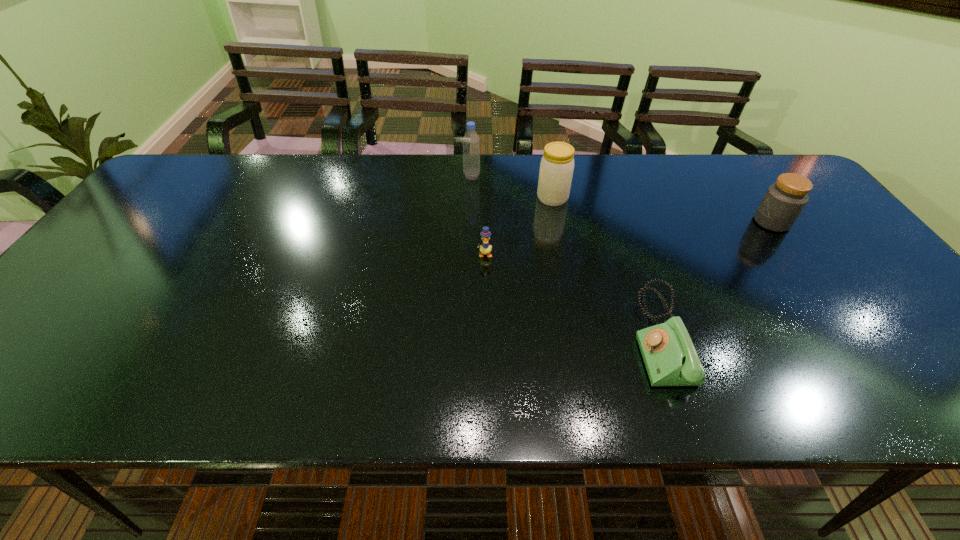
At what (x,y) coordinates should I click in order to perform the action: click on object positioned at the right edge. Please return your answer as a coordinate pair (x, y). Looking at the image, I should click on (784, 200).

In the image, there is a desktop. At what (x,y) coordinates should I click in order to perform the action: click on vacant space at the far edge. Please return your answer as a coordinate pair (x, y). Looking at the image, I should click on (299, 177).

The width and height of the screenshot is (960, 540). Find the location of `vacant area at the right edge`. vacant area at the right edge is located at coordinates (833, 256).

Image resolution: width=960 pixels, height=540 pixels. I want to click on free spot at the far left corner of the desktop, so click(x=220, y=165).

At what (x,y) coordinates should I click in order to perform the action: click on unoccupied area between the bottle and the third farthest object. Please return your answer as a coordinate pair (x, y). Image resolution: width=960 pixels, height=540 pixels. Looking at the image, I should click on (622, 199).

You are a GUI agent. You are given a task and a screenshot of the screen. Output one action in this format:
    pyautogui.click(x=<x>, y=<y>)
    Task: Click on the vacant point located between the fourth farthest object and the second farthest object
    
    Given the screenshot: What is the action you would take?
    pyautogui.click(x=518, y=226)

Where is `vacant area that lies between the fourth object from left to right and the second nearest object`? vacant area that lies between the fourth object from left to right and the second nearest object is located at coordinates (572, 295).

Locate an element on the screen. vacant space that's between the nearest object and the duckling is located at coordinates (572, 295).

The image size is (960, 540). I want to click on free space between the second nearest object and the second object from right to left, so click(x=572, y=295).

Find the location of a particular element. The width and height of the screenshot is (960, 540). empty location between the third nearest object and the bottle is located at coordinates (622, 199).